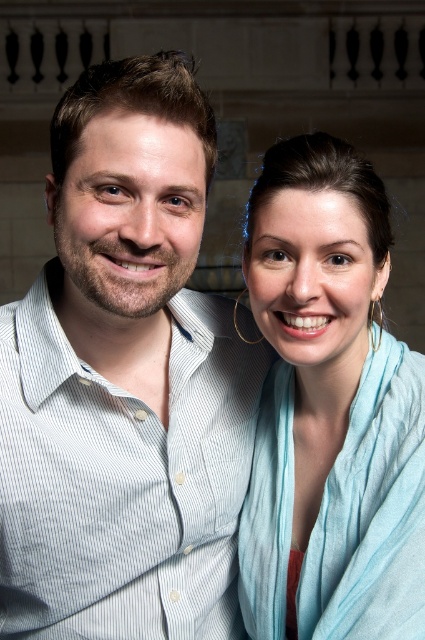
Question: Where is light blue silk scarf at right located in relation to light blue striped shirt at center in the image?

Choices:
 (A) below
 (B) above

Answer: (A)

Question: Which point is closer to the camera taking this photo?

Choices:
 (A) (14, 621)
 (B) (368, 333)

Answer: (A)

Question: Can you confirm if light blue silk scarf at right is positioned to the left of light blue striped shirt at center?

Choices:
 (A) no
 (B) yes

Answer: (A)

Question: Which of the following is the closest to the observer?

Choices:
 (A) (189, 426)
 (B) (291, 200)

Answer: (B)

Question: Can you confirm if light blue silk scarf at right is bigger than light blue striped shirt at center?

Choices:
 (A) no
 (B) yes

Answer: (A)